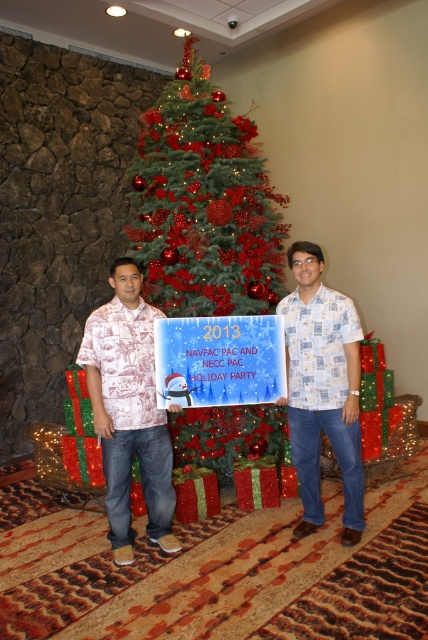
You are planning to take a photo of the green textured christmas tree at center and the printed cotton shirt at center. Which object is wider in the image?

The green textured christmas tree at center is wider than the printed cotton shirt at center according to the description.

You are taking a photo of the two men standing in front of the Christmas tree. You want to focus on the man on the left first. Which point, point [198,189] or point [306,285], is closer to the camera and should be your focus point?

Point [198,189] is closer to the camera than point [306,285], so you should focus on point [198,189] to capture the man on the left clearly.